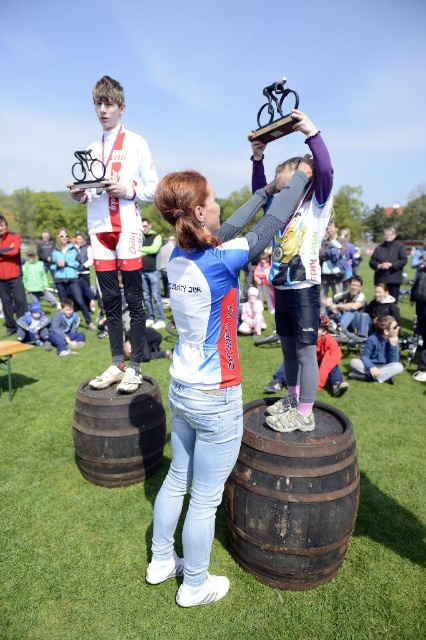
Question: Which object appears closest to the camera in this image?

Choices:
 (A) white matte jersey at center
 (B) brown wooden barrel at lower center
 (C) metallic silver bicycle at upper center

Answer: (A)

Question: Which object is the farthest from the metallic silver bicycle at upper center?

Choices:
 (A) brown wooden barrel at lower center
 (B) white matte jersey at center
 (C) dark brown wooden barrel at center

Answer: (C)

Question: Is white matte jersey at center above metallic silver bicycle at upper center?

Choices:
 (A) yes
 (B) no

Answer: (B)

Question: Can you confirm if white matte jersey at center is thinner than metallic silver bicycle at upper center?

Choices:
 (A) no
 (B) yes

Answer: (B)

Question: Based on their relative distances, which object is farther from the metallic silver bicycle at upper center?

Choices:
 (A) brown wooden barrel at lower center
 (B) dark brown wooden barrel at center

Answer: (B)

Question: Considering the relative positions of white matte jersey at center and metallic silver bicycle at upper center in the image provided, where is white matte jersey at center located with respect to metallic silver bicycle at upper center?

Choices:
 (A) above
 (B) below

Answer: (B)